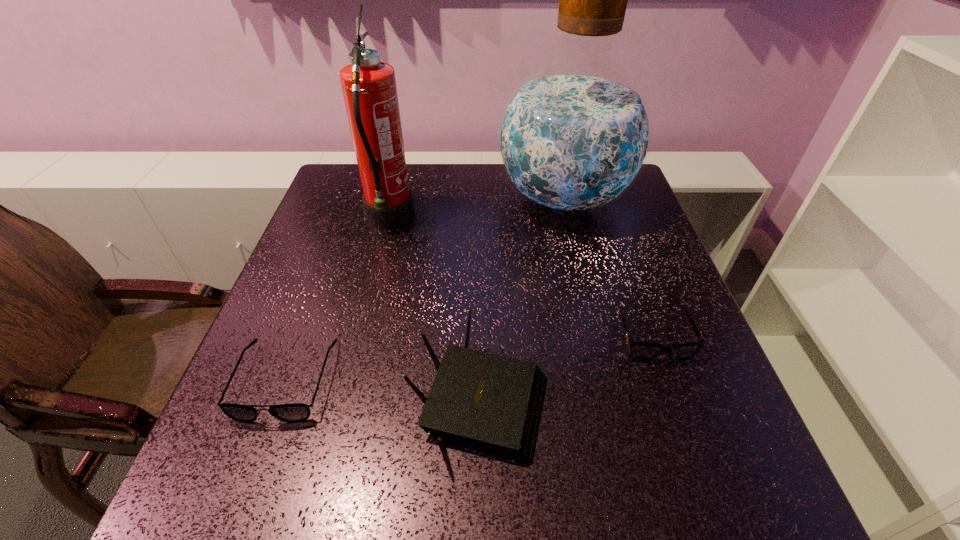
Where is `vacant area that lies between the water jug and the sunglasses`? vacant area that lies between the water jug and the sunglasses is located at coordinates (608, 267).

You are a GUI agent. You are given a task and a screenshot of the screen. Output one action in this format:
    pyautogui.click(x=<x>, y=<y>)
    Task: Click on the free spot between the third tallest object and the sunglasses
    This screenshot has width=960, height=540.
    Given the screenshot: What is the action you would take?
    566,366

Identify the location of vacant space that's between the fire extinguisher and the water jug. (476, 210).

Select which object is the closest to the water jug. Please provide its 2D coordinates. Your answer should be formatted as a tuple, i.e. [(x, y)], where the tuple contains the x and y coordinates of a point satisfying the conditions above.

[(369, 89)]

Find the location of a particular element. The width and height of the screenshot is (960, 540). object identified as the second closest to the spectacles is located at coordinates [x=369, y=89].

Identify the location of vacant space that satisfies the following two spatial constraints: 1. on the front-facing side of the fire extinguisher; 2. on the front-facing side of the spectacles. This screenshot has height=540, width=960. (350, 381).

Image resolution: width=960 pixels, height=540 pixels. I want to click on free space that satisfies the following two spatial constraints: 1. on the front-facing side of the third shortest object; 2. on the left side of the fire extinguisher, so click(x=347, y=396).

The height and width of the screenshot is (540, 960). In order to click on free spot that satisfies the following two spatial constraints: 1. on the back side of the water jug; 2. on the right side of the router in this screenshot , I will do `click(480, 199)`.

Locate an element on the screen. free space that satisfies the following two spatial constraints: 1. on the front-facing side of the fire extinguisher; 2. on the front-facing side of the spectacles is located at coordinates (350, 381).

I want to click on vacant area in the image that satisfies the following two spatial constraints: 1. on the back side of the third shortest object; 2. on the front-facing side of the fire extinguisher, so click(480, 221).